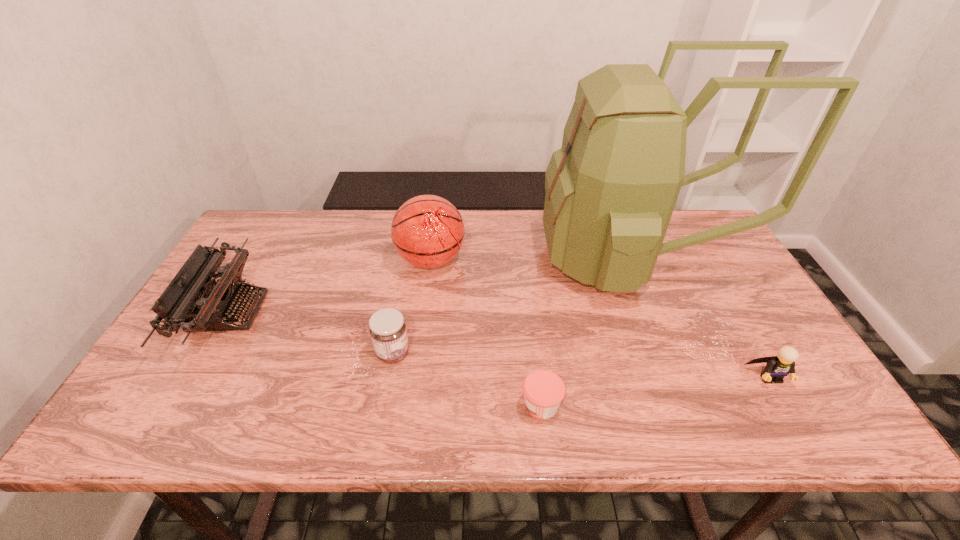
At what (x,y) coordinates should I click in order to perform the action: click on vacant point located on the front pocket of the tallest object. Please return your answer as a coordinate pair (x, y). This screenshot has height=540, width=960. Looking at the image, I should click on (413, 258).

Identify the location of vacant space located 0.170m on the side with spill of the second tallest object. The image size is (960, 540). (521, 260).

The width and height of the screenshot is (960, 540). In order to click on vacant point located on the typing side of the typewriter in this screenshot , I will do `click(339, 312)`.

You are a GUI agent. You are given a task and a screenshot of the screen. Output one action in this format:
    pyautogui.click(x=<x>, y=<y>)
    Task: Click on the vacant space located 0.300m on the front label of the farther jam
    
    Given the screenshot: What is the action you would take?
    pyautogui.click(x=534, y=353)

Locate an element on the screen. The width and height of the screenshot is (960, 540). vacant space situated 0.090m on the front-facing side of the Lego is located at coordinates (798, 425).

Identify the location of vacant space located on the front label of the nearer jam. (374, 405).

You are a GUI agent. You are given a task and a screenshot of the screen. Output one action in this format:
    pyautogui.click(x=<x>, y=<y>)
    Task: Click on the free space located on the front label of the nearer jam
    The height and width of the screenshot is (540, 960).
    Given the screenshot: What is the action you would take?
    pyautogui.click(x=379, y=405)

Find the location of `free point located 0.170m on the front label of the nearer jam`. free point located 0.170m on the front label of the nearer jam is located at coordinates (443, 405).

Where is `backpack at the far edge`? backpack at the far edge is located at coordinates (611, 189).

Where is `basketball that is at the far edge`? This screenshot has width=960, height=540. basketball that is at the far edge is located at coordinates (427, 231).